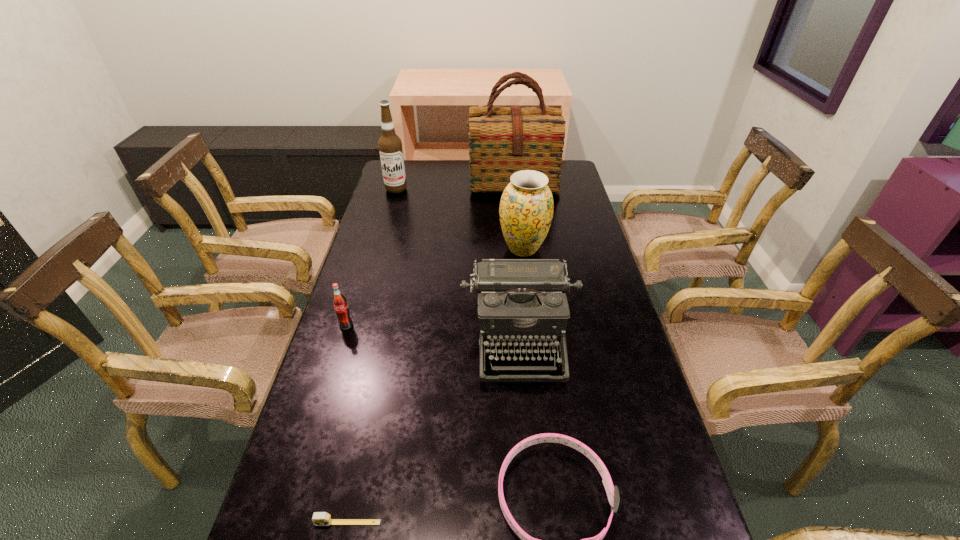
Where is `shopping bag`? This screenshot has width=960, height=540. shopping bag is located at coordinates (502, 140).

The height and width of the screenshot is (540, 960). Identify the location of the second tallest object. (390, 145).

At what (x,y) coordinates should I click in order to perform the action: click on vase. Please return your answer as a coordinate pair (x, y). The width and height of the screenshot is (960, 540). Looking at the image, I should click on (526, 208).

At what (x,y) coordinates should I click in order to perform the action: click on the fifth shortest object. Please return your answer as a coordinate pair (x, y). Image resolution: width=960 pixels, height=540 pixels. Looking at the image, I should click on (526, 208).

Where is `typewriter`? This screenshot has width=960, height=540. typewriter is located at coordinates (521, 302).

Locate an element on the screen. the fifth tallest object is located at coordinates [340, 304].

Locate an element on the screen. This screenshot has width=960, height=540. the shortest object is located at coordinates (319, 518).

You are a GUI agent. You are given a task and a screenshot of the screen. Output one action in this format:
    pyautogui.click(x=<x>, y=<y>)
    Task: Click on the free space located on the open handle side of the shopping bag
    
    Given the screenshot: What is the action you would take?
    pyautogui.click(x=516, y=206)

Locate an element on the screen. This screenshot has height=540, width=960. vacant space located 0.080m on the label of the alcohol is located at coordinates (392, 205).

Image resolution: width=960 pixels, height=540 pixels. Identify the location of vacant space located 0.070m on the right of the fifth nearest object. (569, 248).